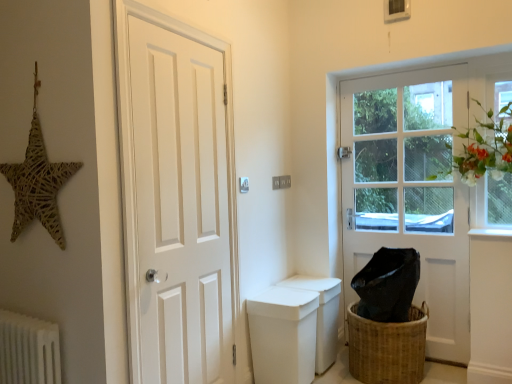
Question: Is point (403, 119) positioned closer to the camera than point (479, 221)?

Choices:
 (A) closer
 (B) farther

Answer: (B)

Question: Visually, is white wooden door at right, acting as the 1th door starting from the back, positioned to the left or to the right of clear glass window at upper right?

Choices:
 (A) left
 (B) right

Answer: (A)

Question: Which of these objects is positioned farthest from the white smooth window sill at lower right?

Choices:
 (A) white matte door at left, which is the 1th door in front-to-back order
 (B) woven brown basket at lower right
 (C) clear glass window at upper right
 (D) white matte toilet bowl at center
 (E) woven straw star at upper left

Answer: (E)

Question: Estimate the real-world distances between objects in this image. Which object is farther from the white matte door at left, which is the 1th door in front-to-back order?

Choices:
 (A) white textured radiator at lower left
 (B) woven straw star at upper left
 (C) white matte toilet bowl at center
 (D) white smooth window sill at lower right
 (E) woven brown basket at lower right

Answer: (D)